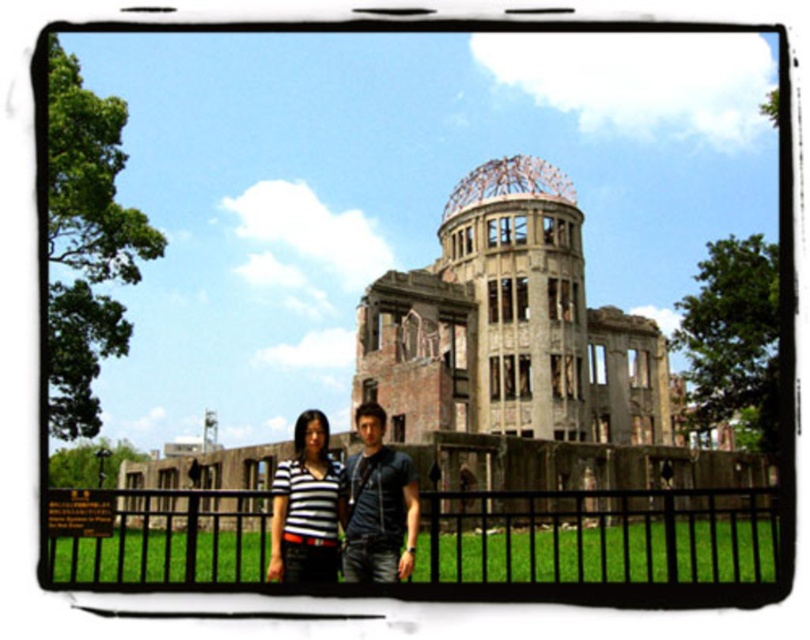
Question: Does rustic stone dome at center appear on the left side of striped fabric shirt at center?

Choices:
 (A) no
 (B) yes

Answer: (A)

Question: Which point is closer to the camera?

Choices:
 (A) (681, 397)
 (B) (308, 464)
 (C) (745, 524)
 (D) (391, 481)

Answer: (D)

Question: Which point appears closest to the camera in this image?

Choices:
 (A) (109, 532)
 (B) (617, 458)

Answer: (A)

Question: Is rustic stone dome at center positioned before dark blue t-shirt at center?

Choices:
 (A) no
 (B) yes

Answer: (A)

Question: Observing the image, what is the correct spatial positioning of black metal fence at lower center in reference to striped fabric shirt at center?

Choices:
 (A) above
 (B) below

Answer: (B)

Question: Estimate the real-world distances between objects in this image. Which object is farther from the striped fabric shirt at center?

Choices:
 (A) black metal fence at lower center
 (B) dark blue t-shirt at center
 (C) rustic stone dome at center

Answer: (C)